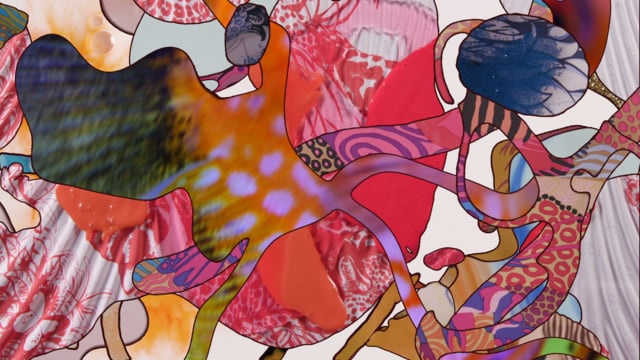
Find the location of `black blind design`. black blind design is located at coordinates (65, 73), (99, 131).